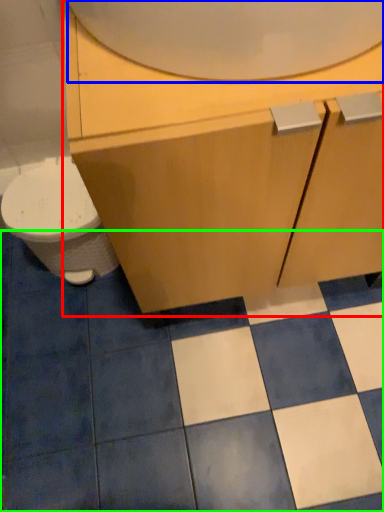
Question: Which object is the closest to the bathroom cabinet (highlighted by a red box)? Choose among these: mirror (highlighted by a blue box) or ceramic tile (highlighted by a green box).

Choices:
 (A) mirror
 (B) ceramic tile

Answer: (A)